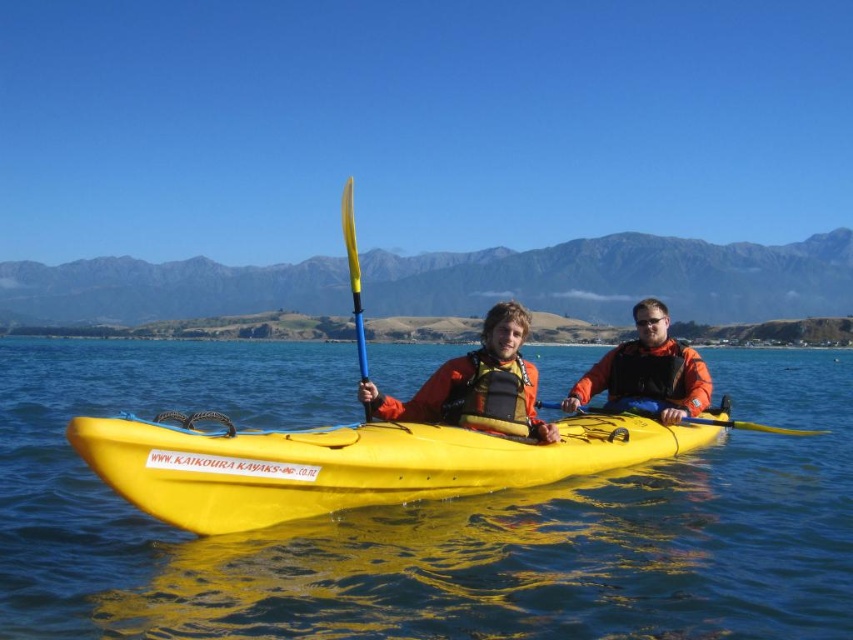
Can you confirm if yellow plastic kayak at center is positioned to the left of orange soft life jacket at center?

Indeed, yellow plastic kayak at center is positioned on the left side of orange soft life jacket at center.

Is the position of yellow plastic kayak at center less distant than that of orange soft life jacket at center?

Yes, yellow plastic kayak at center is in front of orange soft life jacket at center.

Which is behind, point (223, 618) or point (669, 400)?

Point (669, 400)

Where is `yellow plastic kayak at center`? yellow plastic kayak at center is located at coordinates (424, 516).

Which is more to the left, yellow plastic kayak at center or orange life vest at center?

yellow plastic kayak at center is more to the left.

Which is below, yellow plastic kayak at center or orange life vest at center?

yellow plastic kayak at center

Between point (71, 630) and point (635, 330), which one is positioned in front?

Positioned in front is point (71, 630).

Find the location of `yellow plastic kayak at center`. yellow plastic kayak at center is located at coordinates (424, 516).

Is yellow plastic kayak at center thinner than yellow plastic paddle at center?

In fact, yellow plastic kayak at center might be wider than yellow plastic paddle at center.

Which is behind, point (374, 588) or point (357, 268)?

Point (357, 268)

Locate an element on the screen. yellow plastic kayak at center is located at coordinates (424, 516).